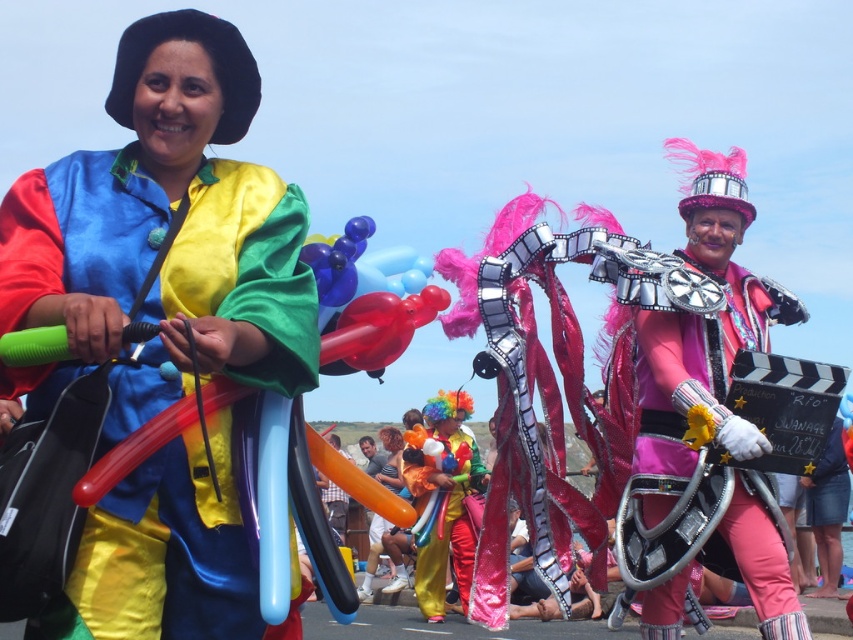
You are a photographer at the parade. You want to take a photo focusing on the shiny metallic clown at center without the pink satin film strip at center blocking it. Is this possible given their positions?

The pink satin film strip at center is closer to the viewer than the shiny metallic clown at center, so it would block the clown in the photo. To avoid this, you need to adjust your position or angle to ensure the pink satin film strip at center is not in front of the clown.

You are a photographer standing at the camera position. You want to capture a closeup shot of the shiny satin balloon at center. Considering the distance, do you think you can use a standard zoom lens with a maximum focal length of 200mm to achieve this? Assume the balloon is 0.5 meters in diameter and the camera sensor size is 24x36 mm.

The shiny satin balloon at center is 35.14 meters away. Using the lens equation, the required focal length would be approximately 35.14m x 0.5m sensor width ratio. However, precise calculation shows that a 200mm lens may not provide sufficient magnification to capture the balloon as a closeup given the distance. A longer telephoto lens would be more appropriate.